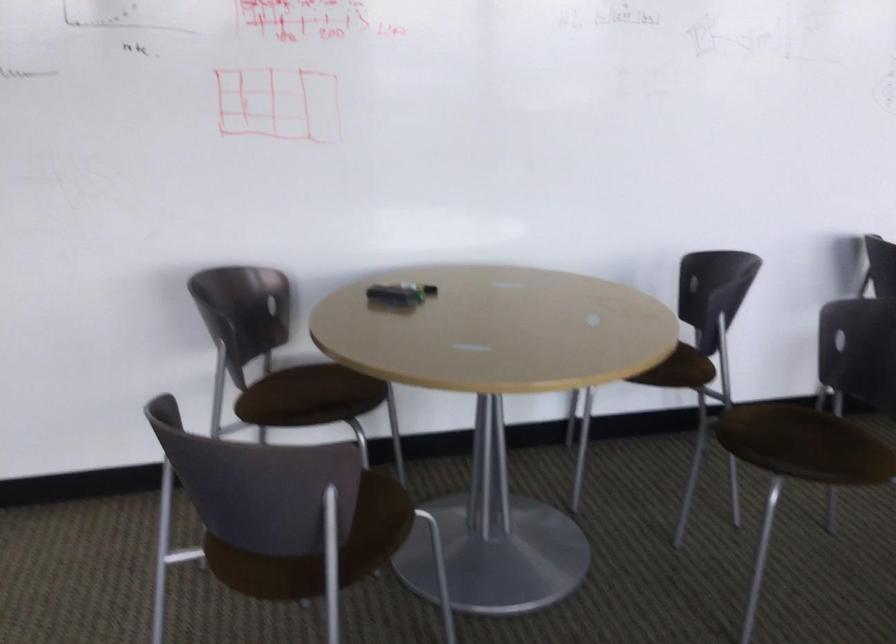
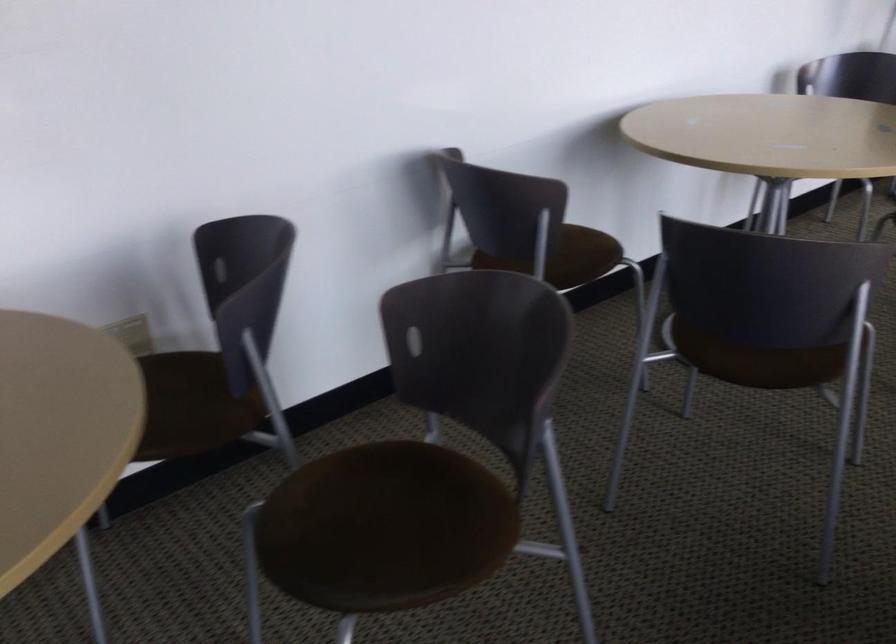
Question: The camera is either moving clockwise (left) or counter-clockwise (right) around the object. The first image is from the beginning of the video and the second image is from the end. Is the camera moving left or right when shooting the video?

Choices:
 (A) Left
 (B) Right

Answer: (A)